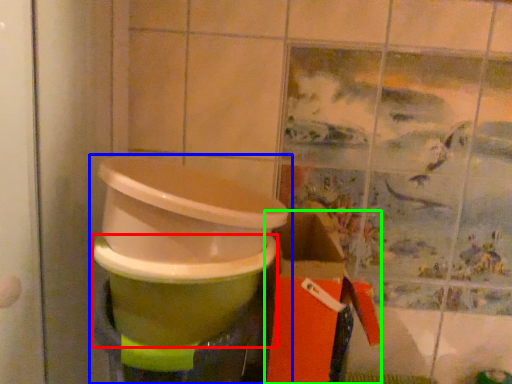
Question: Which is farther away from toilet bowl (highlighted by a red box)? waste container (highlighted by a blue box) or box (highlighted by a green box)?

Choices:
 (A) waste container
 (B) box

Answer: (B)